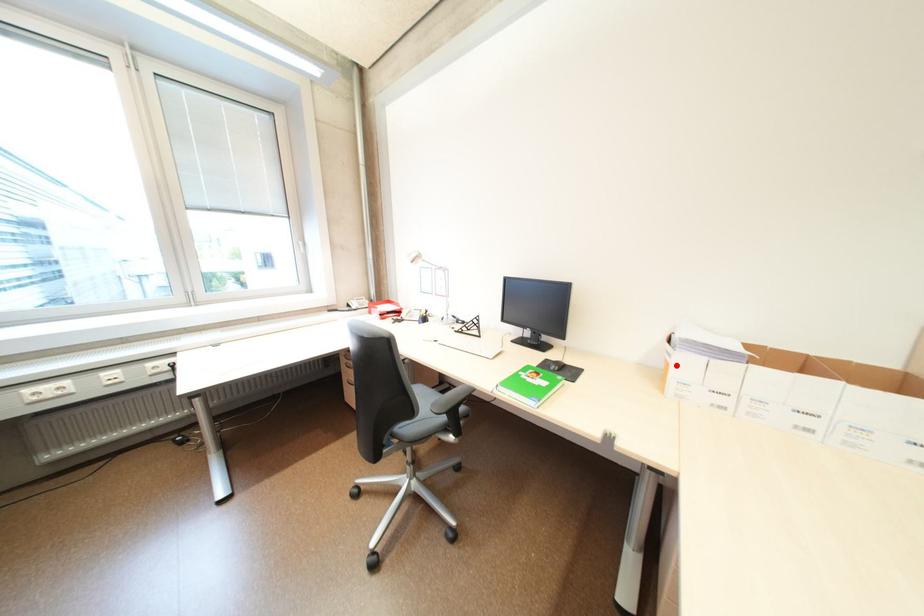
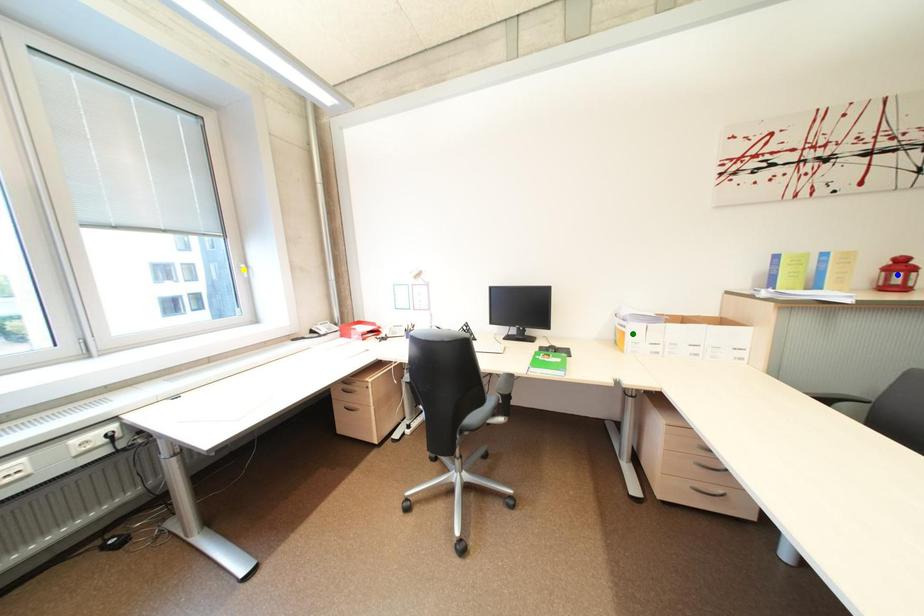
Question: I am providing you with two images of the same scene from different viewpoints. A red point is marked on the first image. You are given multiple points on the second image. In image 2, which mark is for the same physical point as the one in image 1?

Choices:
 (A) blue point
 (B) yellow point
 (C) green point

Answer: (C)